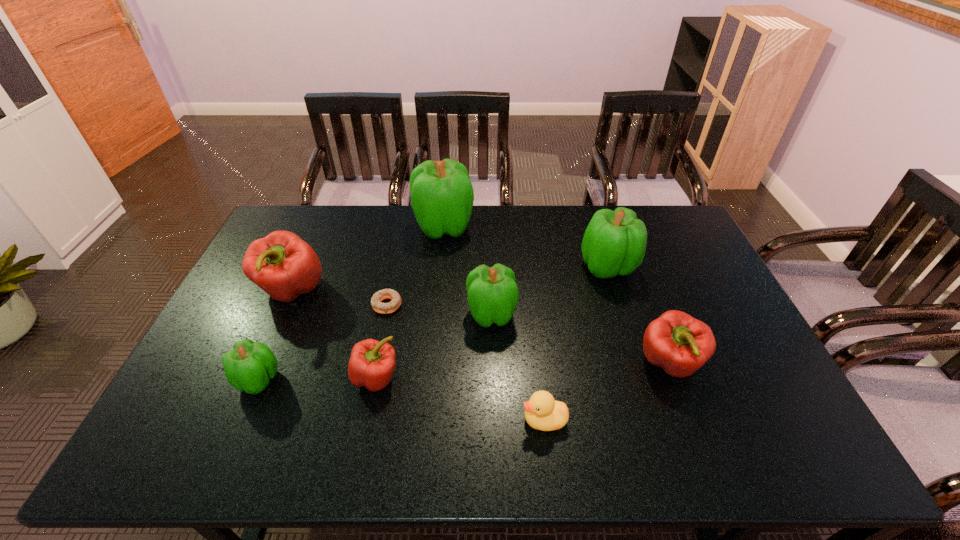
This screenshot has height=540, width=960. I want to click on the second pink bell pepper from right to left, so click(371, 364).

Where is `the second shortest object`? The height and width of the screenshot is (540, 960). the second shortest object is located at coordinates (542, 412).

Where is `yellow duck`? The height and width of the screenshot is (540, 960). yellow duck is located at coordinates (542, 412).

This screenshot has height=540, width=960. I want to click on the shortest object, so click(x=376, y=301).

In order to click on chocolate doughnut in this screenshot , I will do `click(376, 301)`.

Where is `vacant space located 0.070m on the right of the tallest object`? vacant space located 0.070m on the right of the tallest object is located at coordinates (493, 226).

Identify the location of free region located on the left of the second farthest green bell pepper. (544, 267).

In order to click on vacant area situated on the front of the farthest pink bell pepper in this screenshot , I will do (234, 423).

This screenshot has height=540, width=960. I want to click on vacant space located 0.260m on the left of the second nearest green bell pepper, so click(x=380, y=314).

Where is `vacant space located 0.140m on the right of the second biggest pink bell pepper`? Image resolution: width=960 pixels, height=540 pixels. vacant space located 0.140m on the right of the second biggest pink bell pepper is located at coordinates (753, 364).